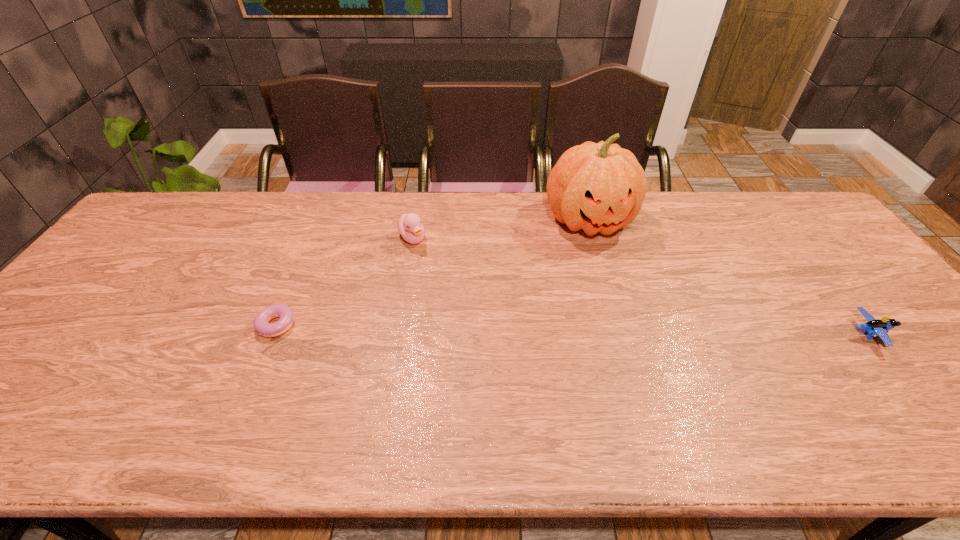
Locate an element on the screen. The image size is (960, 540). vacant space at the near edge is located at coordinates (367, 387).

Find the location of a particular element. blank space at the left edge of the desktop is located at coordinates (76, 300).

The width and height of the screenshot is (960, 540). In the image, there is a desktop. Identify the location of blank space at the right edge. point(822,250).

The height and width of the screenshot is (540, 960). In the image, there is a desktop. What are the coordinates of `vacant space at the far left corner` in the screenshot? It's located at (168, 233).

At what (x,y) coordinates should I click in order to perform the action: click on vacant space at the near left corner of the desktop. Please return your answer as a coordinate pair (x, y). The width and height of the screenshot is (960, 540). Looking at the image, I should click on (21, 383).

Image resolution: width=960 pixels, height=540 pixels. Identify the location of free location at the far right corner. (767, 199).

Identify the location of free space that is in between the third tallest object and the shortest object. (573, 329).

Where is `free space that is in between the shortest object and the Lego`? The width and height of the screenshot is (960, 540). free space that is in between the shortest object and the Lego is located at coordinates (573, 329).

Identify the location of vacant region between the tallest object and the rightmost object. (728, 278).

Identify the location of unoccupied position between the shortest object and the pumpkin. The image size is (960, 540). (435, 273).